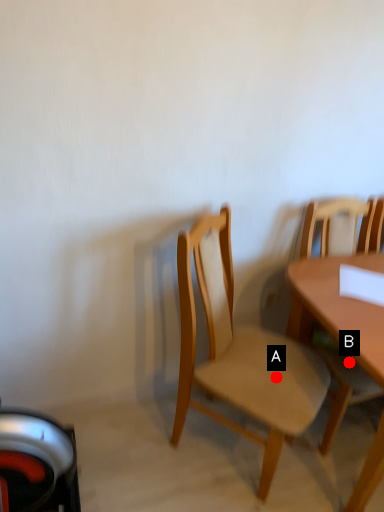
Question: Two points are circled on the image, labeled by A and B beside each circle. Which point appears closest to the camera in this image?

Choices:
 (A) A is closer
 (B) B is closer

Answer: (A)